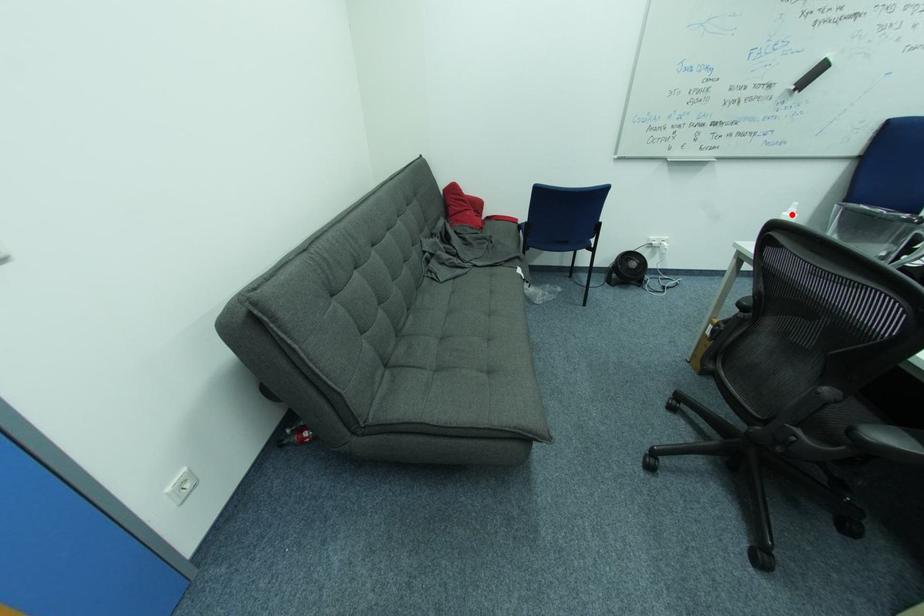
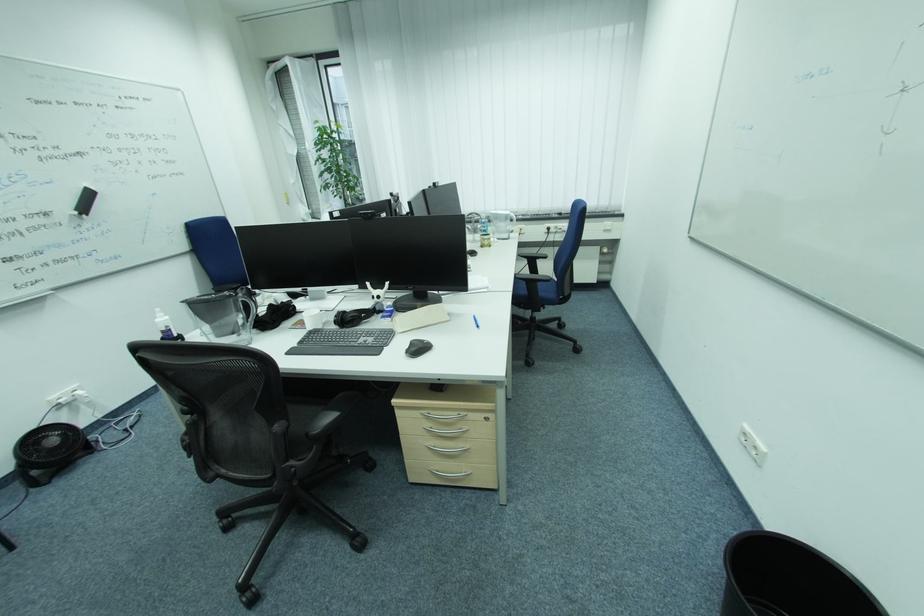
The point at the highlighted location is marked in the first image. Where is the corresponding point in the second image?

(164, 321)